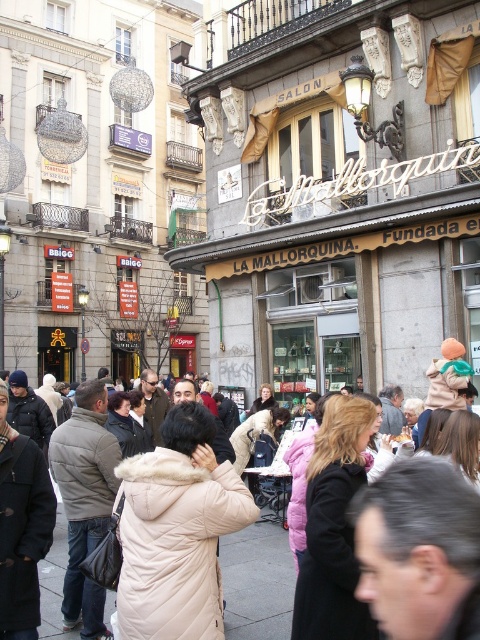
Question: Can you confirm if beige wool coat at center is positioned above beige quilted coat at center?

Choices:
 (A) no
 (B) yes

Answer: (B)

Question: Can you confirm if beige wool coat at center is positioned above beige quilted coat at center?

Choices:
 (A) no
 (B) yes

Answer: (B)

Question: Among these points, which one is nearest to the camera?

Choices:
 (A) (268, 202)
 (B) (269, 557)
 (C) (253, 611)

Answer: (C)

Question: Which object appears closest to the camera in this image?

Choices:
 (A) matte yellow awning at center
 (B) beige wool coat at center

Answer: (B)

Question: Which of the following is the closest to the observer?

Choices:
 (A) matte yellow awning at center
 (B) beige quilted coat at center
 (C) beige wool coat at center

Answer: (C)

Question: Does beige wool coat at center come in front of beige quilted coat at center?

Choices:
 (A) no
 (B) yes

Answer: (B)